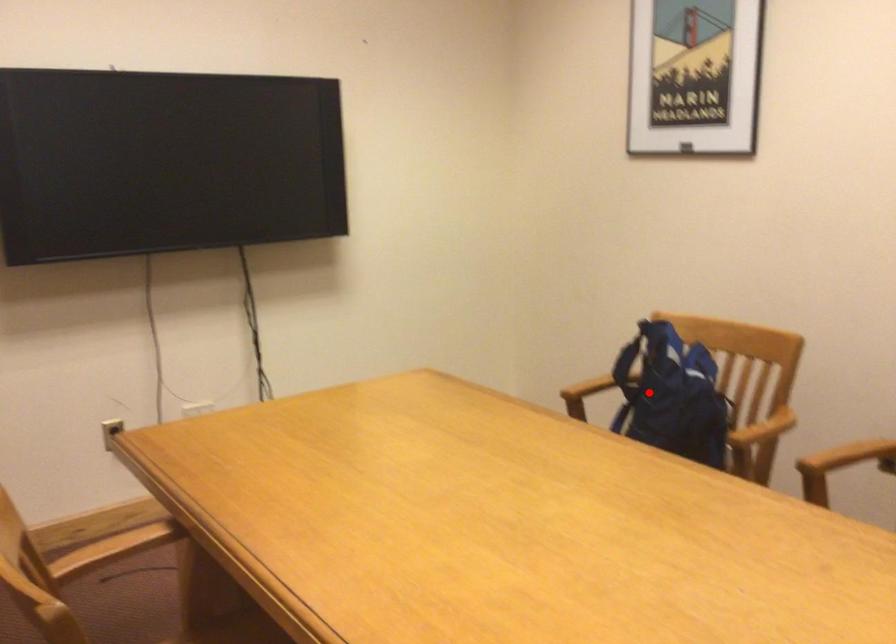
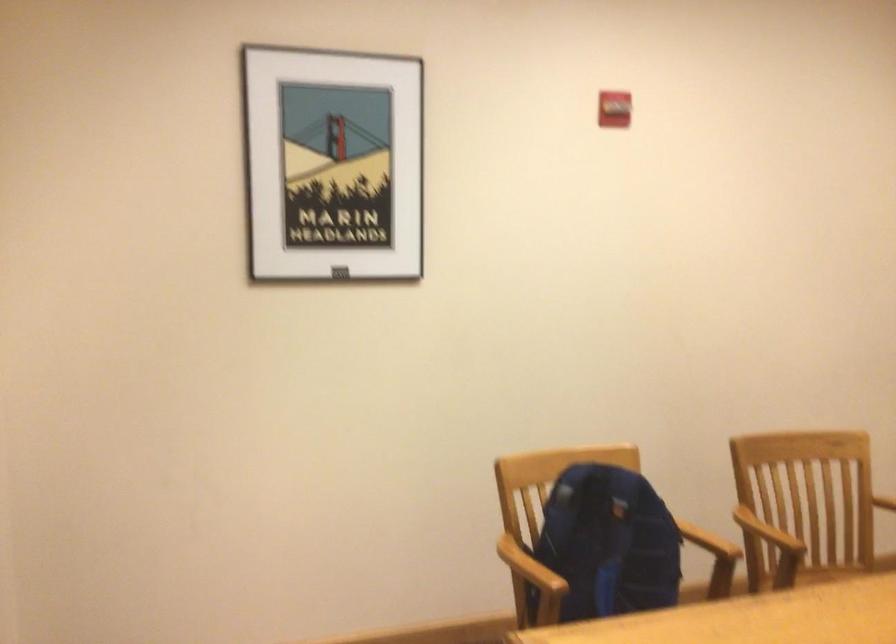
The point at the highlighted location is marked in the first image. Where is the corresponding point in the second image?

(607, 544)